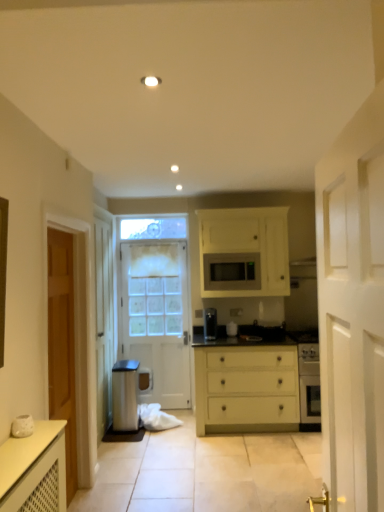
Question: From their relative heights in the image, would you say matte yellow chest of drawers at center is taller or shorter than white wooden door at right, the second door viewed from the left?

Choices:
 (A) tall
 (B) short

Answer: (B)

Question: From a real-world perspective, is matte yellow chest of drawers at center physically located above or below white wooden door at right, which appears as the first door when viewed from the front?

Choices:
 (A) below
 (B) above

Answer: (A)

Question: Which of these objects is positioned closest to the white wooden door at right, the 2th door viewed from the right?

Choices:
 (A) matte yellow chest of drawers at center
 (B) matte black microwave at center
 (C) white matte microwave at center, which appears as the first door when viewed from the right
 (D) white painted wood door at center, positioned as the third door in right-to-left order

Answer: (A)

Question: Which object is positioned closest to the white wooden door at right, the 2th door viewed from the right?

Choices:
 (A) matte black microwave at center
 (B) matte yellow chest of drawers at center
 (C) white painted wood door at center, which appears as the first door when viewed from the back
 (D) white matte microwave at center, the second door from the back

Answer: (B)